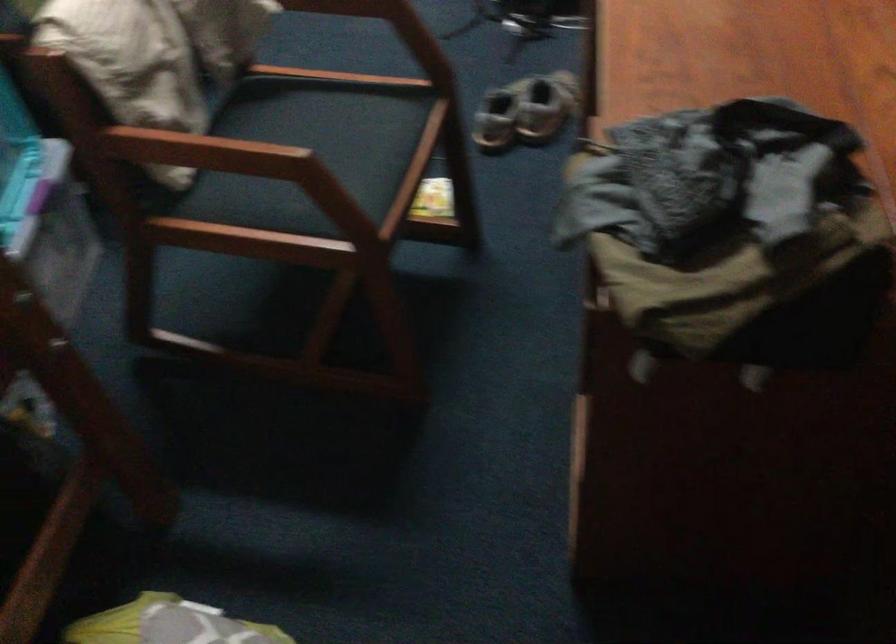
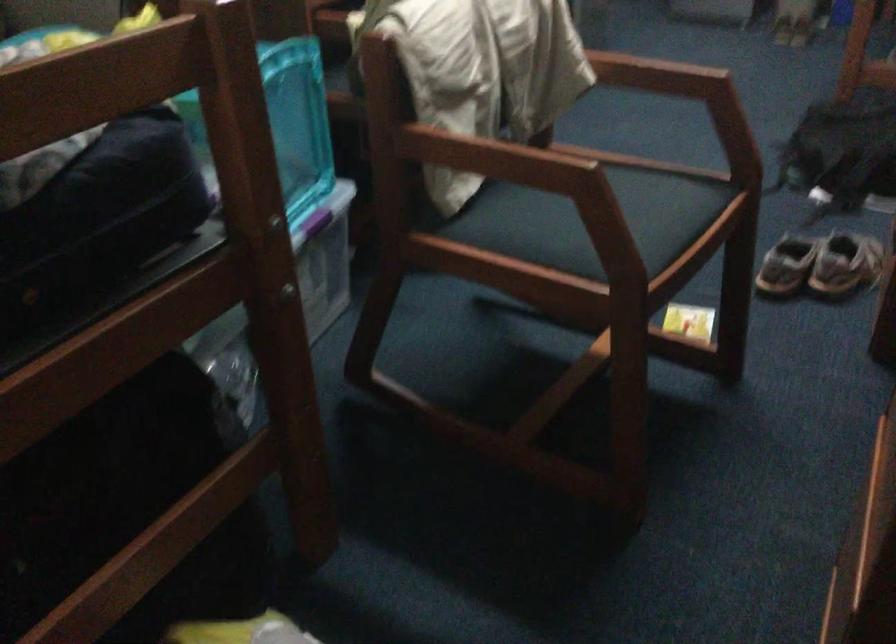
Question: Based on the continuous images, in which direction is the camera rotating? Reply with the corresponding letter.

Choices:
 (A) Left
 (B) Right
 (C) Up
 (D) Down

Answer: (A)